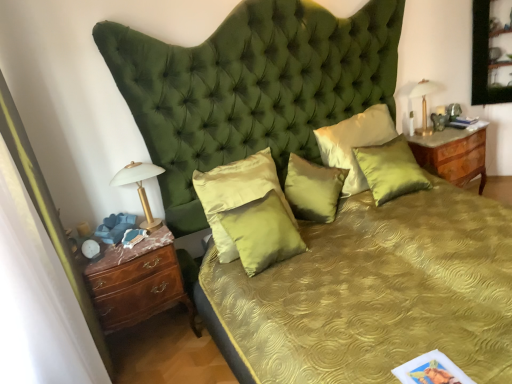
Question: Based on their positions, is burlwood/marble nightstand at right located to the left or right of satin gold pillow at center, arranged as the 5th pillow when viewed from the right?

Choices:
 (A) left
 (B) right

Answer: (B)

Question: Is point (437, 158) closer or farther from the camera than point (216, 221)?

Choices:
 (A) farther
 (B) closer

Answer: (A)

Question: Estimate the real-world distances between objects in this image. Which object is farther from the satin gold pillow at center, the first pillow from the left?

Choices:
 (A) white glass bedside lamp at left, acting as the first bedside lamp starting from the bottom
 (B) gold metallic lamp at upper right, the 1th bedside lamp from the top
 (C) burlwood/marble nightstand at right
 (D) brown wood chest of drawers at left
 (E) satin green pillow at center, which is the fourth pillow from left to right

Answer: (B)

Question: Considering the real-world distances, which object is closest to the brown wood chest of drawers at left?

Choices:
 (A) satin green pillow at center, which appears as the 3th pillow when viewed from the left
 (B) satin green pillow at center, the 5th pillow when ordered from left to right
 (C) white glass bedside lamp at left, marked as the 1th bedside lamp in a front-to-back arrangement
 (D) burlwood/marble nightstand at right
 (E) satin green pillow at center, which is the fourth pillow from left to right

Answer: (C)